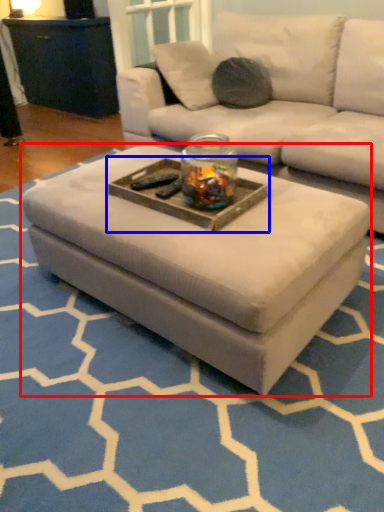
Question: Which point is further to the camera, coffee table (highlighted by a red box) or tray (highlighted by a blue box)?

Choices:
 (A) coffee table
 (B) tray

Answer: (B)